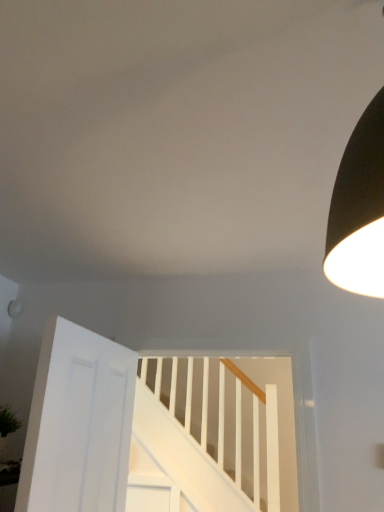
Measure the distance between point (46, 349) and camera.

1.42 meters.

The image size is (384, 512). In order to click on white matte door at lower left in this screenshot , I will do `click(78, 423)`.

The image size is (384, 512). What do you see at coordinates (78, 423) in the screenshot?
I see `white matte door at lower left` at bounding box center [78, 423].

Locate an element on the screen. The image size is (384, 512). white wooden stairs at center is located at coordinates (178, 461).

In order to face white wooden stairs at center, should I rotate leftwards or rightwards?

It's best to rotate right around 1.433 degrees.

This screenshot has height=512, width=384. What do you see at coordinates (178, 461) in the screenshot?
I see `white wooden stairs at center` at bounding box center [178, 461].

This screenshot has height=512, width=384. What are the coordinates of `white matte door at lower left` in the screenshot? It's located at (78, 423).

Does white wooden stairs at center appear on the left side of white matte door at lower left?

Incorrect, white wooden stairs at center is not on the left side of white matte door at lower left.

Based on the photo, considering the positions of objects white wooden stairs at center and white matte door at lower left in the image provided, who is in front, white wooden stairs at center or white matte door at lower left?

Positioned in front is white matte door at lower left.

Is point (232, 493) farther from camera compared to point (47, 503)?

That is True.

From the image's perspective, relative to white matte door at lower left, is white wooden stairs at center above or below?

white wooden stairs at center is below white matte door at lower left.

From the picture: From a real-world perspective, between white wooden stairs at center and white matte door at lower left, who is vertically lower?

From a 3D spatial view, white matte door at lower left is below.

Which object is thinner, white wooden stairs at center or white matte door at lower left?

white matte door at lower left is thinner.

Between white wooden stairs at center and white matte door at lower left, which one has more height?

With more height is white wooden stairs at center.

Considering the sizes of objects white wooden stairs at center and white matte door at lower left in the image provided, who is bigger, white wooden stairs at center or white matte door at lower left?

With larger size is white wooden stairs at center.

Is white wooden stairs at center spatially inside white matte door at lower left, or outside of it?

white wooden stairs at center lies outside white matte door at lower left.

Is white wooden stairs at center not near white matte door at lower left?

white wooden stairs at center is positioned a significant distance from white matte door at lower left.

Is white wooden stairs at center turned away from white matte door at lower left?

That's not correct — white wooden stairs at center is not looking away from white matte door at lower left.

You are a GUI agent. You are given a task and a screenshot of the screen. Output one action in this format:
    pyautogui.click(x=<x>, y=<y>)
    Task: Click on the stairs located above the white matte door at lower left (from a real-world perspective)
    The height and width of the screenshot is (512, 384).
    Given the screenshot: What is the action you would take?
    pyautogui.click(x=178, y=461)

Which is more to the left, white matte door at lower left or white wooden stairs at center?

Positioned to the left is white matte door at lower left.

Is white matte door at lower left closer to the viewer compared to white wooden stairs at center?

Yes, it is.

Which point is more forward, (131, 391) or (237, 508)?

The point (131, 391) is closer to the camera.

From the image's perspective, is white matte door at lower left under white wooden stairs at center?

Actually, white matte door at lower left appears above white wooden stairs at center in the image.

From a real-world perspective, who is located lower, white matte door at lower left or white wooden stairs at center?

white matte door at lower left.

Considering the sizes of objects white matte door at lower left and white wooden stairs at center in the image provided, who is wider, white matte door at lower left or white wooden stairs at center?

white wooden stairs at center.

Considering the relative sizes of white matte door at lower left and white wooden stairs at center in the image provided, is white matte door at lower left taller than white wooden stairs at center?

No, white matte door at lower left is not taller than white wooden stairs at center.

Is white matte door at lower left bigger than white wooden stairs at center?

No, white matte door at lower left is not bigger than white wooden stairs at center.

Is white matte door at lower left outside of white wooden stairs at center?

Absolutely, white matte door at lower left is external to white wooden stairs at center.

Based on the photo, would you say white matte door at lower left is a long distance from white wooden stairs at center?

Yes, white matte door at lower left is far from white wooden stairs at center.

Does white matte door at lower left turn towards white wooden stairs at center?

Yes, white matte door at lower left is oriented towards white wooden stairs at center.

This screenshot has width=384, height=512. I want to click on stairs to the right of white matte door at lower left, so click(x=178, y=461).

You are a GUI agent. You are given a task and a screenshot of the screen. Output one action in this format:
    pyautogui.click(x=<x>, y=<y>)
    Task: Click on the door below the white wooden stairs at center (from a real-world perspective)
    The height and width of the screenshot is (512, 384).
    Given the screenshot: What is the action you would take?
    pyautogui.click(x=78, y=423)

Identify the location of door in front of the white wooden stairs at center. This screenshot has width=384, height=512. (78, 423).